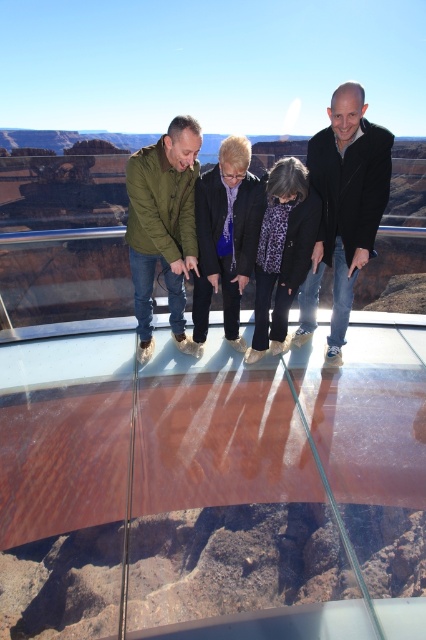
Which is more to the left, transparent glass table at center or purple fabric at center?

purple fabric at center is more to the left.

Does transparent glass table at center appear over purple fabric at center?

No.

Which is behind, point (181, 362) or point (207, 321)?

The point (207, 321) is more distant.

Find the location of `transparent glass table at center`. transparent glass table at center is located at coordinates (212, 484).

How much distance is there between black matte jacket at center and leopard print coat at center?

black matte jacket at center and leopard print coat at center are 14.22 inches apart from each other.

Which is more to the right, black matte jacket at center or leopard print coat at center?

From the viewer's perspective, black matte jacket at center appears more on the right side.

What do you see at coordinates (344, 208) in the screenshot? I see `black matte jacket at center` at bounding box center [344, 208].

You are a GUI agent. You are given a task and a screenshot of the screen. Output one action in this format:
    pyautogui.click(x=<x>, y=<y>)
    Task: Click on the black matte jacket at center
    
    Given the screenshot: What is the action you would take?
    pyautogui.click(x=344, y=208)

Which is behind, point (385, 339) or point (149, 314)?

The point (385, 339) is more distant.

Based on the photo, between transparent glass table at center and green matte jacket at left, which one has more height?

green matte jacket at left is taller.

Describe the element at coordinates (212, 484) in the screenshot. This screenshot has width=426, height=640. I see `transparent glass table at center` at that location.

The image size is (426, 640). Find the location of `transparent glass table at center`. transparent glass table at center is located at coordinates (212, 484).